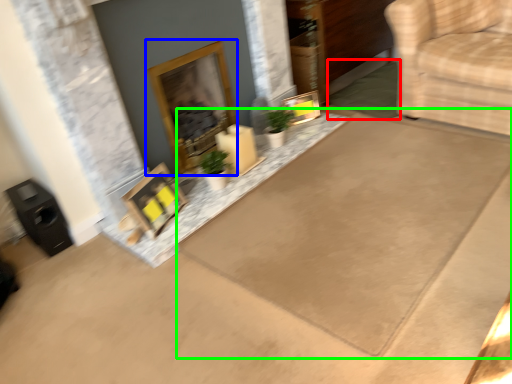
Question: Estimate the real-world distances between objects in this image. Which object is closer to doormat (highlighted by a red box), fireplace (highlighted by a blue box) or doormat (highlighted by a green box)?

Choices:
 (A) fireplace
 (B) doormat

Answer: (B)